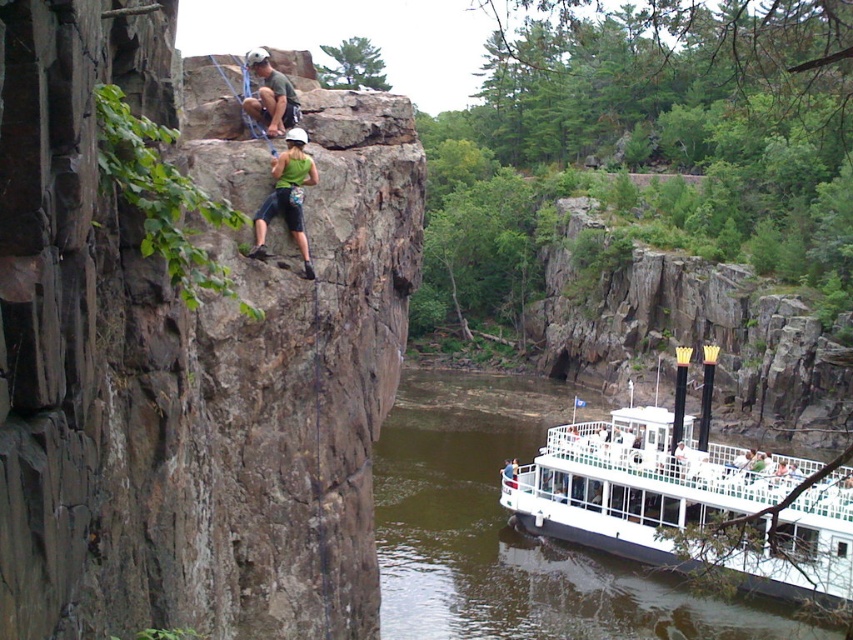
You are a hiker who wants to take a photo of the rusty stone cliff at upper center and the white wooden boat at lower right. Which object should you focus on first if you want to capture both in one frame without moving the camera?

You should focus on the rusty stone cliff at upper center first because it is closer to you than the white wooden boat at lower right, allowing both to be in focus when using a single focal point.

You are a drone operator trying to capture the best aerial shot of the rusty stone cliff at upper center. According to the image coordinates, where should you position the drone to focus on the cliff?

The rusty stone cliff at upper center is located at coordinates point (189, 355), so the drone should be positioned to focus on that point.

You are a drone operator tasked with capturing aerial footage of the rusty stone cliff at upper center. Based on its position in the image, can you determine if the cliff is positioned in the upper half of the frame?

The rusty stone cliff at upper center is located at point coordinates approximately 0.555 on the x and 0.222 on the y axis. Since the y coordinate is 0.222, which is less than 0.5, this places it in the upper half of the frame. Therefore, the cliff is indeed positioned in the upper half of the image.